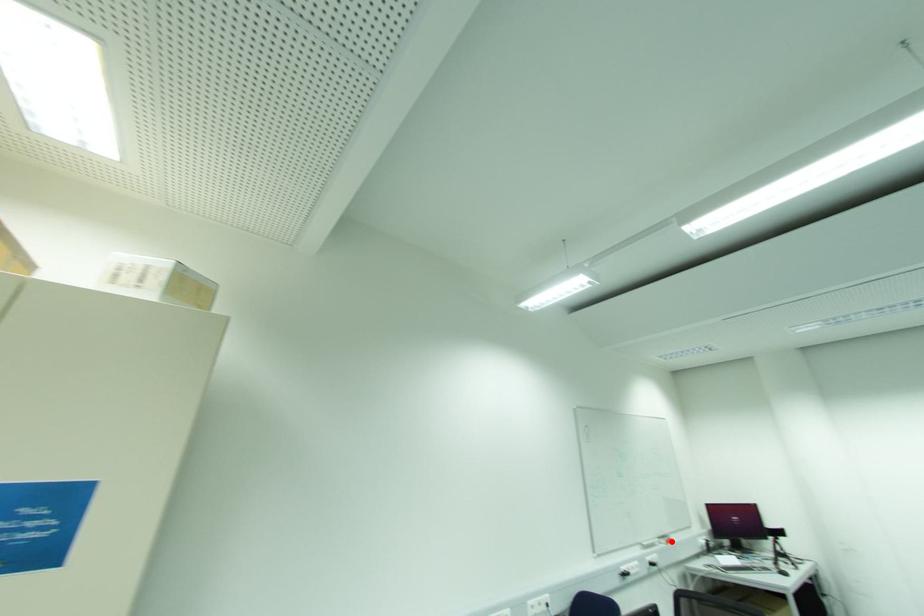
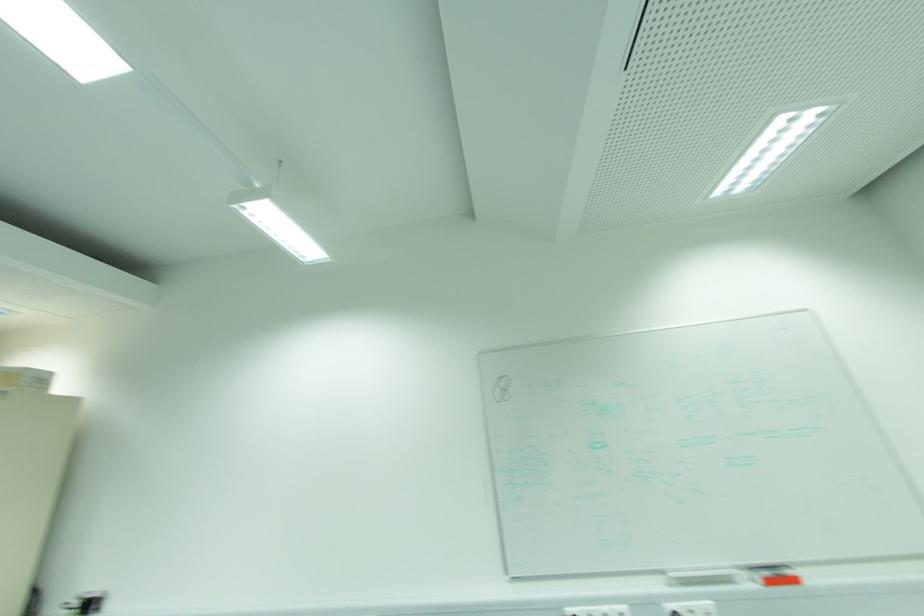
Question: I am providing you with two images of the same scene from different viewpoints. A red point is marked on the first image. Can you still see the location of the red point in image 2?

Choices:
 (A) Yes
 (B) No

Answer: (A)